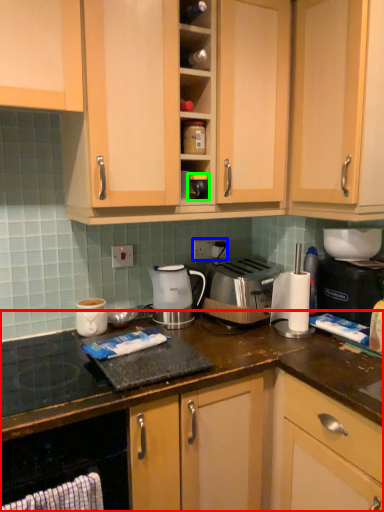
Question: Based on their relative distances, which object is nearer to cabinetry (highlighted by a red box)? Choose from electric outlet (highlighted by a blue box) and appliance (highlighted by a green box).

Choices:
 (A) electric outlet
 (B) appliance

Answer: (A)